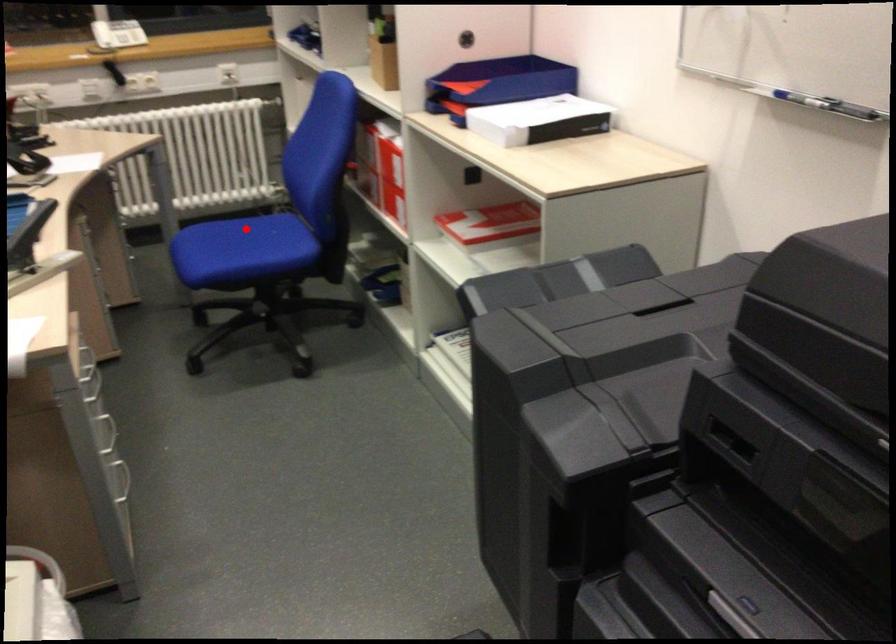
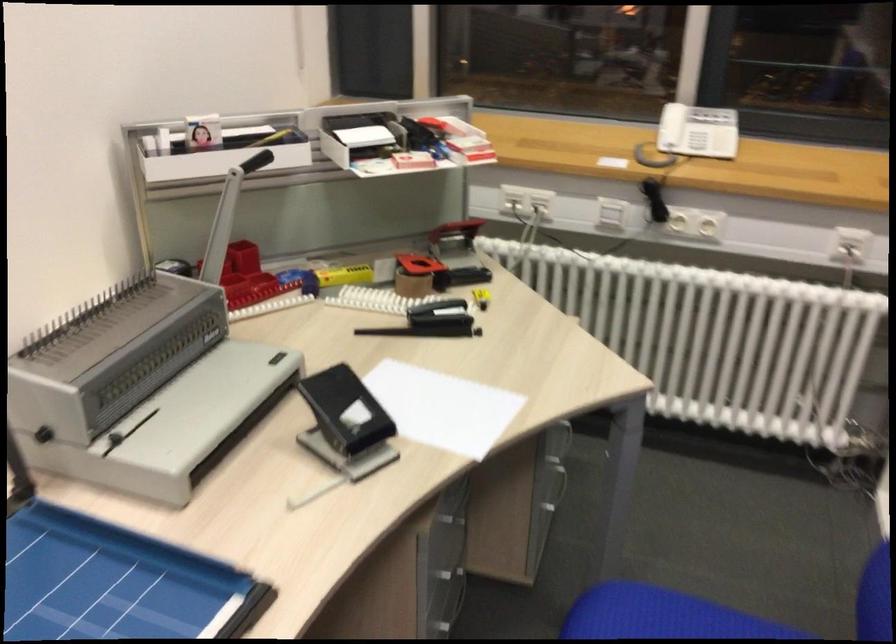
Question: A red point is marked in image1. In image2, is the corresponding 3D point closer to the camera or farther? Reply with the corresponding letter.

Choices:
 (A) The corresponding 3D point is closer.
 (B) The corresponding 3D point is farther.

Answer: (A)